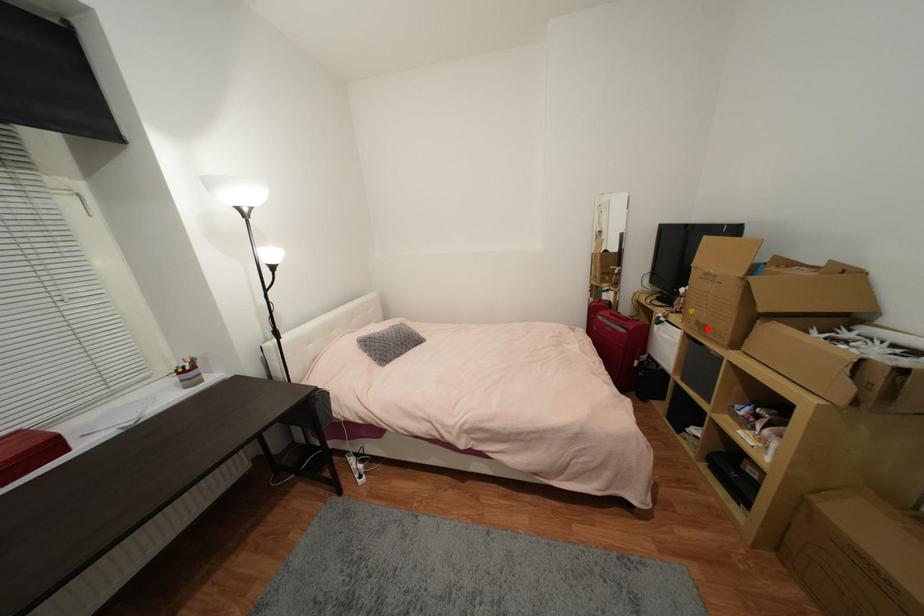
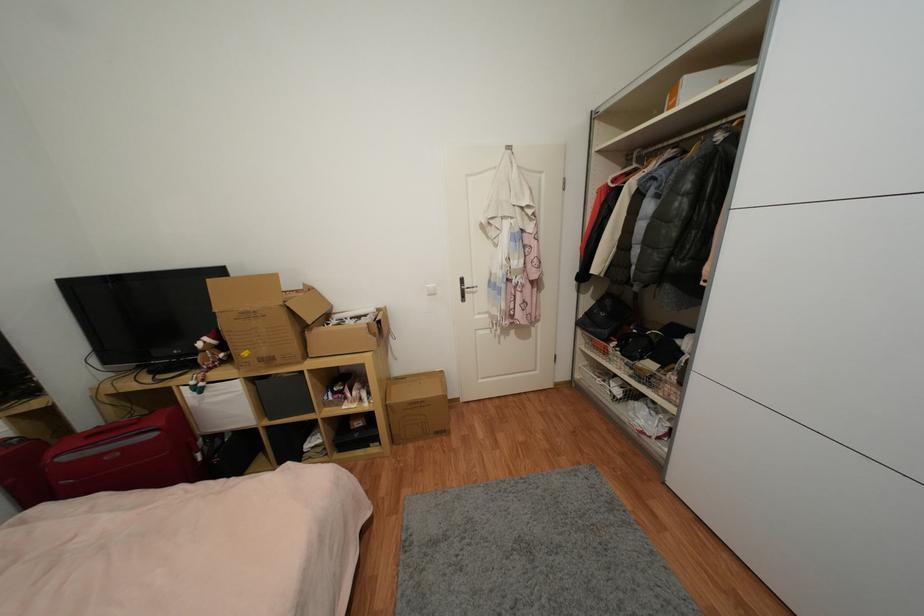
Question: I am providing you with two images of the same scene from different viewpoints. Given a red point in image1, look at the same physical point in image2. Is it:

Choices:
 (A) Closer to the viewpoint
 (B) Farther from the viewpoint

Answer: (B)